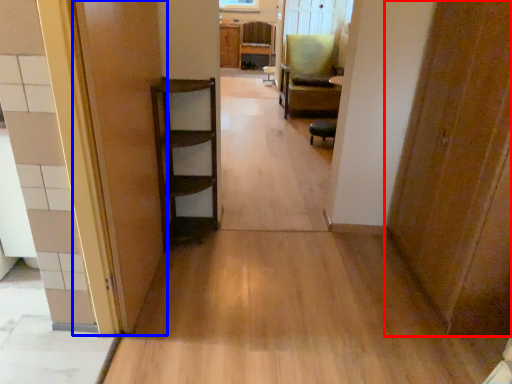
Question: Which object appears closest to the camera in this image, door (highlighted by a red box) or door (highlighted by a blue box)?

Choices:
 (A) door
 (B) door

Answer: (B)